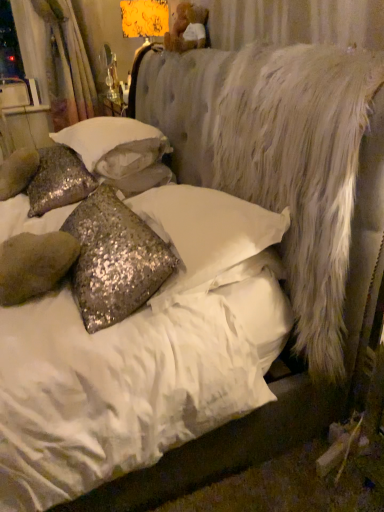
Question: Is sparkly silver pillow at left, marked as the 1th pillow in a back-to-front arrangement, at the back of white fluffy mattress at right?

Choices:
 (A) no
 (B) yes

Answer: (A)

Question: Does white fluffy mattress at right have a larger size compared to sparkly silver pillow at left, marked as the 1th pillow in a back-to-front arrangement?

Choices:
 (A) yes
 (B) no

Answer: (A)

Question: Can you confirm if white fluffy mattress at right is positioned to the left of sparkly silver pillow at left, marked as the 1th pillow in a back-to-front arrangement?

Choices:
 (A) no
 (B) yes

Answer: (A)

Question: Is white fluffy mattress at right thinner than sparkly silver pillow at left, marked as the 1th pillow in a back-to-front arrangement?

Choices:
 (A) no
 (B) yes

Answer: (A)

Question: Would you say white fluffy mattress at right contains sparkly silver pillow at left, arranged as the third pillow when viewed from the front?

Choices:
 (A) yes
 (B) no

Answer: (B)

Question: From a real-world perspective, does white fluffy mattress at right sit lower than sparkly silver pillow at left, marked as the 1th pillow in a back-to-front arrangement?

Choices:
 (A) no
 (B) yes

Answer: (A)

Question: From the image's perspective, does white sequined pillow at center, which is the second pillow in back-to-front order, appear lower than sparkly silver pillow at left, arranged as the third pillow when viewed from the front?

Choices:
 (A) no
 (B) yes

Answer: (A)

Question: Can you confirm if white sequined pillow at center, which is the second pillow in back-to-front order, is bigger than sparkly silver pillow at left, arranged as the third pillow when viewed from the front?

Choices:
 (A) no
 (B) yes

Answer: (B)

Question: Is white sequined pillow at center, positioned as the 2th pillow in front-to-back order, oriented away from sparkly silver pillow at left, arranged as the third pillow when viewed from the front?

Choices:
 (A) yes
 (B) no

Answer: (B)

Question: From the image's perspective, would you say white sequined pillow at center, positioned as the 2th pillow in front-to-back order, is positioned over sparkly silver pillow at left, marked as the 1th pillow in a back-to-front arrangement?

Choices:
 (A) yes
 (B) no

Answer: (A)

Question: Does white sequined pillow at center, which is the second pillow in back-to-front order, have a greater height compared to sparkly silver pillow at left, marked as the 1th pillow in a back-to-front arrangement?

Choices:
 (A) no
 (B) yes

Answer: (A)

Question: Does white sequined pillow at center, which is the second pillow in back-to-front order, have a smaller size compared to sparkly silver pillow at left, arranged as the third pillow when viewed from the front?

Choices:
 (A) yes
 (B) no

Answer: (B)

Question: Is sparkly silver pillow at left, arranged as the third pillow when viewed from the front, further to camera compared to white textured curtain at upper left?

Choices:
 (A) no
 (B) yes

Answer: (A)